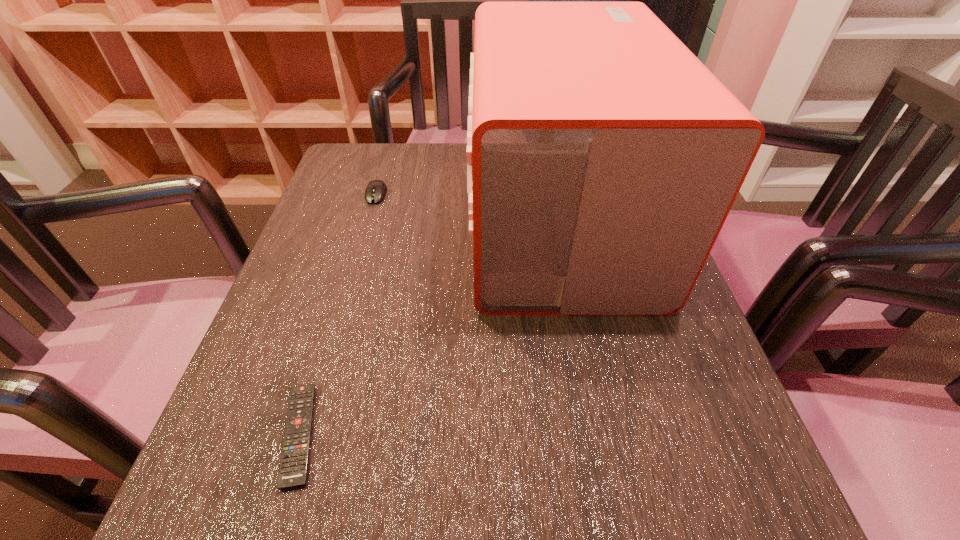
Find the location of `box`. box is located at coordinates (603, 157).

The width and height of the screenshot is (960, 540). I want to click on the tallest object, so click(603, 157).

Find the location of `the second tallest object`. the second tallest object is located at coordinates (376, 190).

This screenshot has width=960, height=540. What are the coordinates of `the shortest object` in the screenshot? It's located at (293, 467).

Where is `remote control`? remote control is located at coordinates (293, 467).

Locate an element on the screen. vacant space located on the surface of the tallest object where the text is embossed is located at coordinates (384, 222).

Locate an element on the screen. vacant region located on the surface of the tallest object where the text is embossed is located at coordinates (343, 222).

In order to click on free space located 0.190m on the surface of the tallest object where the text is embossed in this screenshot , I will do `click(384, 222)`.

Where is `vacant area situated 0.400m on the wheel side of the second shortest object`? vacant area situated 0.400m on the wheel side of the second shortest object is located at coordinates (331, 349).

Locate an element on the screen. This screenshot has width=960, height=540. vacant space situated 0.390m on the back of the remote control is located at coordinates (362, 227).